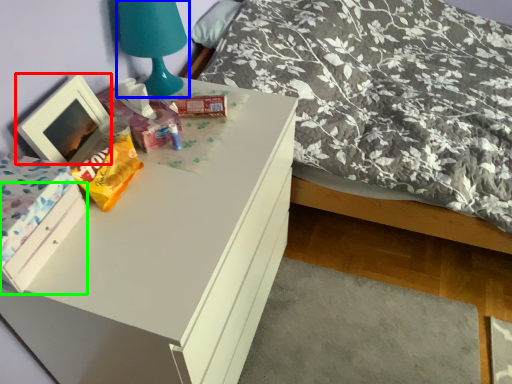
Question: Based on their relative distances, which object is farther from picture frame (highlighted by a red box)? Choose from table lamp (highlighted by a blue box) and drawer (highlighted by a green box).

Choices:
 (A) table lamp
 (B) drawer

Answer: (A)